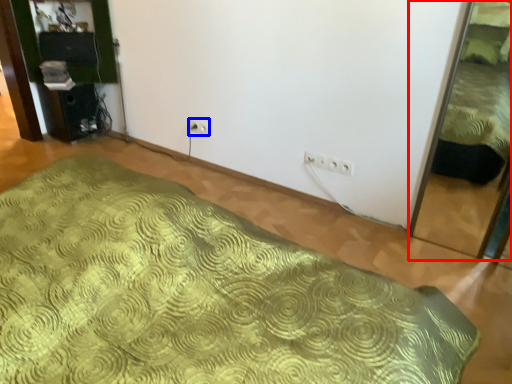
Question: Which point is further to the camera, bed (highlighted by a red box) or electric outlet (highlighted by a blue box)?

Choices:
 (A) bed
 (B) electric outlet

Answer: (B)